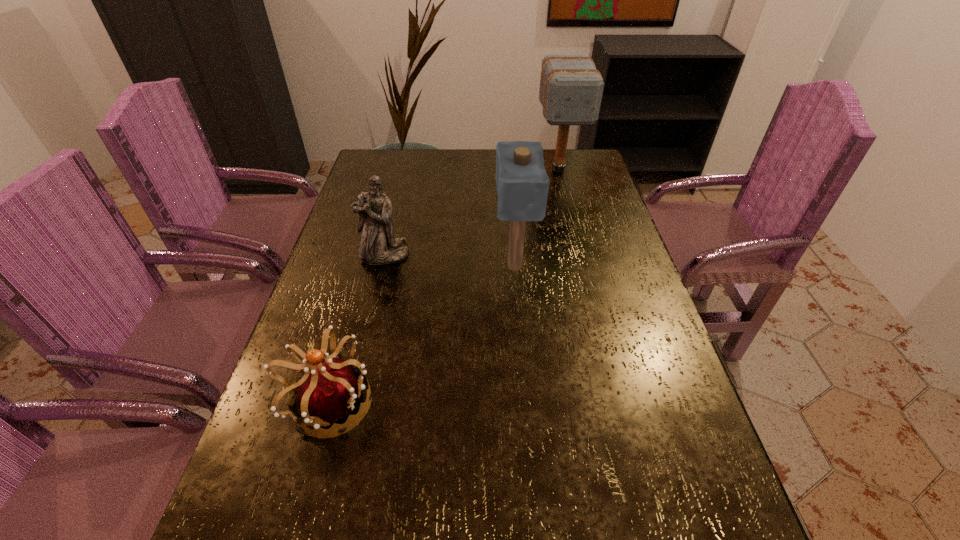
Identify the location of free spot at the far right corner of the desktop. The width and height of the screenshot is (960, 540). (596, 173).

Where is `free spot between the right mallet and the nearest object`? This screenshot has width=960, height=540. free spot between the right mallet and the nearest object is located at coordinates (444, 286).

In order to click on vacant space that is in between the tiara and the second object from right to left in this screenshot , I will do `click(421, 334)`.

Where is `free spot between the nearer mallet and the figurine`? free spot between the nearer mallet and the figurine is located at coordinates (449, 260).

Find the location of `free space between the figurine and the nearest object`. free space between the figurine and the nearest object is located at coordinates (356, 329).

Locate an element on the screen. This screenshot has width=960, height=540. free space between the figurine and the nearest object is located at coordinates (356, 329).

Image resolution: width=960 pixels, height=540 pixels. What are the coordinates of `free space that is in between the third tallest object and the shortest object` in the screenshot? It's located at (356, 329).

Identify the location of free space between the second object from right to left and the second shortest object. (449, 260).

Image resolution: width=960 pixels, height=540 pixels. Find the location of `vacant region between the tiara and the left mallet`. vacant region between the tiara and the left mallet is located at coordinates tap(421, 334).

This screenshot has width=960, height=540. Find the location of `free space between the shortest object and the third tallest object`. free space between the shortest object and the third tallest object is located at coordinates (356, 329).